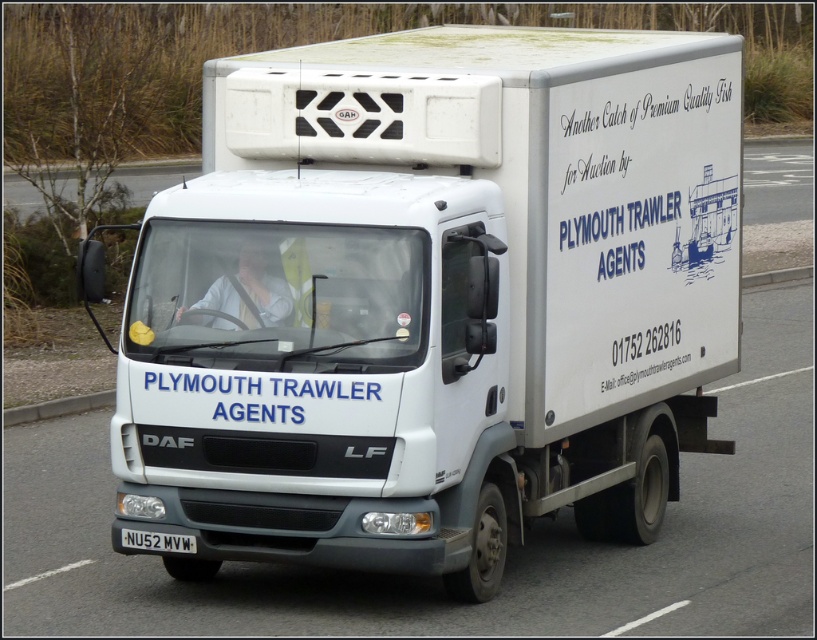
You are a pedestrian standing on the sidewalk. You see the white matte truck at center and the white plastic license plate at lower center. Which object is closer to you?

The white matte truck at center is closer to you because it is in front of the white plastic license plate at lower center.

You are a delivery driver who needs to park the white matte truck at center in a specific parking spot. The parking spot requires vehicles to be positioned exactly at coordinates point A. The current position of the truck is at point B. Can you determine if the truck is correctly parked based on the given coordinates?

The white matte truck at center is located at point (432, 300). If point A matches these coordinates, then it is correctly parked. Otherwise, adjustments are needed.